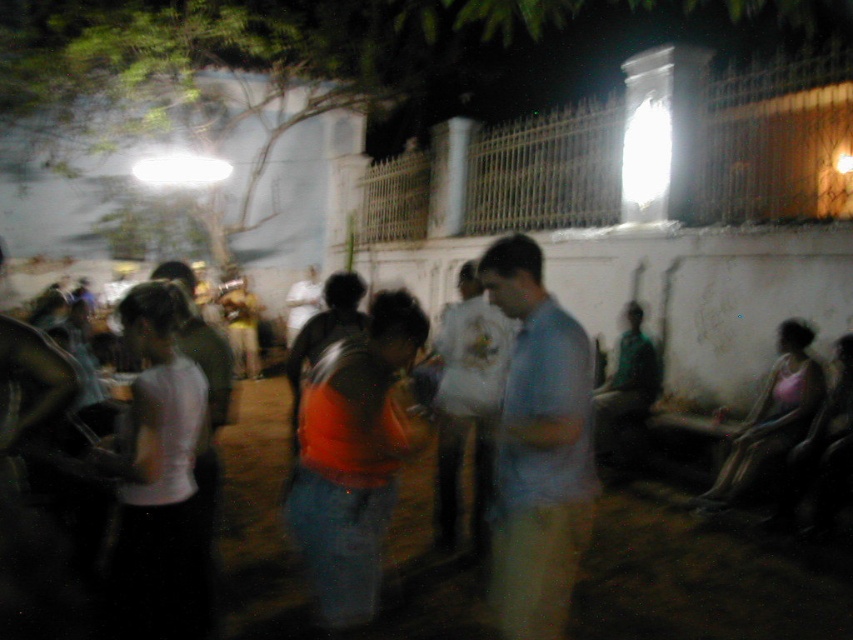
Is light blue fabric shirt at center closer to the viewer compared to white matte bag at center?

Yes, it is.

Between light blue fabric shirt at center and white matte bag at center, which one has less height?

With less height is light blue fabric shirt at center.

Image resolution: width=853 pixels, height=640 pixels. In order to click on light blue fabric shirt at center in this screenshot , I will do `click(538, 449)`.

Identify the location of light blue fabric shirt at center. This screenshot has width=853, height=640. (538, 449).

Is point (848, 584) in front of point (451, 436)?

Yes, it is in front of point (451, 436).

Does orange fabric shirt at center have a greater width compared to white matte bag at center?

Yes.

At what (x,y) coordinates should I click in order to perform the action: click on orange fabric shirt at center. Please return your answer as a coordinate pair (x, y). This screenshot has width=853, height=640. Looking at the image, I should click on (703, 577).

Find the location of a particular element. The width and height of the screenshot is (853, 640). orange fabric shirt at center is located at coordinates (703, 577).

Does orange fabric shirt at center appear over light blue fabric shirt at center?

Incorrect, orange fabric shirt at center is not positioned above light blue fabric shirt at center.

Measure the distance between orange fabric shirt at center and camera.

A distance of 3.37 meters exists between orange fabric shirt at center and camera.

Find the location of a particular element. The height and width of the screenshot is (640, 853). orange fabric shirt at center is located at coordinates point(703,577).